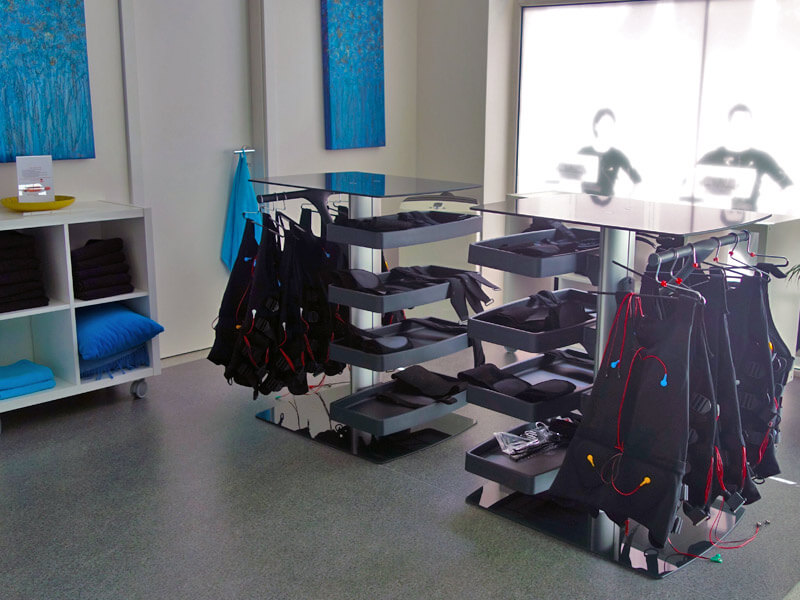
Locate an element on the screen. The width and height of the screenshot is (800, 600). shelf is located at coordinates (420, 411).